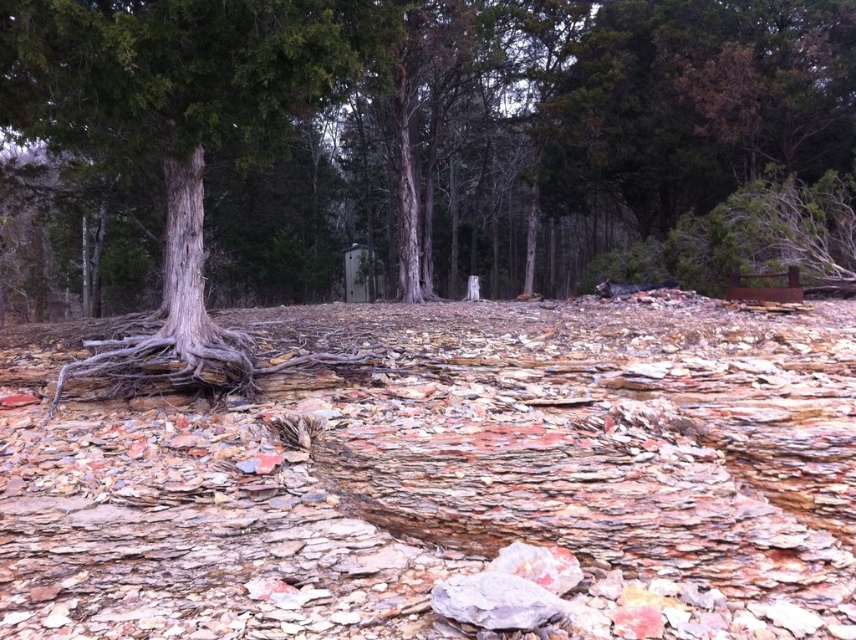
From the picture: You are standing at the center of the image and want to place a small flag exactly at the location of the rusty stone rock at center. What are the coordinates where you should place the flag?

The coordinates for the rusty stone rock at center are at point (446, 476), so you should place the flag there.

You are standing at the center of the scene and want to move towards the point marked at coordinate (446, 476). Is this point located to your left or right side?

The point at coordinate (446, 476) corresponds to the rusty stone rock at center, so it is directly in front of you.